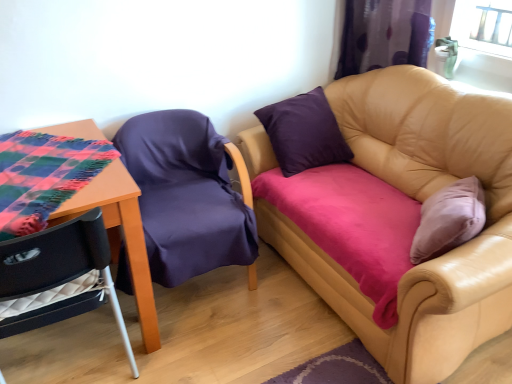
Question: Are tan leather couch at upper right and plaid fabric-covered table at left located far from each other?

Choices:
 (A) no
 (B) yes

Answer: (B)

Question: From a real-world perspective, does tan leather couch at upper right sit lower than plaid fabric-covered table at left?

Choices:
 (A) yes
 (B) no

Answer: (A)

Question: Considering the relative sizes of tan leather couch at upper right and plaid fabric-covered table at left in the image provided, is tan leather couch at upper right bigger than plaid fabric-covered table at left?

Choices:
 (A) yes
 (B) no

Answer: (A)

Question: Does tan leather couch at upper right have a lesser width compared to plaid fabric-covered table at left?

Choices:
 (A) no
 (B) yes

Answer: (A)

Question: Considering the relative positions of tan leather couch at upper right and plaid fabric-covered table at left in the image provided, is tan leather couch at upper right to the left of plaid fabric-covered table at left from the viewer's perspective?

Choices:
 (A) no
 (B) yes

Answer: (A)

Question: Is point (473, 117) closer or farther from the camera than point (194, 274)?

Choices:
 (A) closer
 (B) farther

Answer: (A)

Question: From the image's perspective, is tan leather couch at upper right above or below purple fabric chair at left, the first chair viewed from the right?

Choices:
 (A) above
 (B) below

Answer: (A)

Question: From their relative heights in the image, would you say tan leather couch at upper right is taller or shorter than purple fabric chair at left, the first chair viewed from the right?

Choices:
 (A) tall
 (B) short

Answer: (A)

Question: From a real-world perspective, is tan leather couch at upper right positioned above or below purple fabric chair at left, the second chair in the left-to-right sequence?

Choices:
 (A) below
 (B) above

Answer: (B)

Question: In the image, is plaid fabric-covered table at left positioned in front of or behind velvet purple chair at lower left, which ranks as the 1th chair in left-to-right order?

Choices:
 (A) behind
 (B) front

Answer: (A)

Question: Is point (134, 281) closer or farther from the camera than point (91, 220)?

Choices:
 (A) closer
 (B) farther

Answer: (B)

Question: From a real-world perspective, is plaid fabric-covered table at left physically located above or below velvet purple chair at lower left, which ranks as the 1th chair in left-to-right order?

Choices:
 (A) above
 (B) below

Answer: (A)

Question: From the image's perspective, is plaid fabric-covered table at left positioned above or below velvet purple chair at lower left, which ranks as the 1th chair in left-to-right order?

Choices:
 (A) below
 (B) above

Answer: (B)

Question: Is velvet purple chair at lower left, arranged as the 2th chair when viewed from the right, in front of or behind purple fabric curtain at upper right in the image?

Choices:
 (A) front
 (B) behind

Answer: (A)

Question: From the image's perspective, is velvet purple chair at lower left, arranged as the 2th chair when viewed from the right, positioned above or below purple fabric curtain at upper right?

Choices:
 (A) below
 (B) above

Answer: (A)